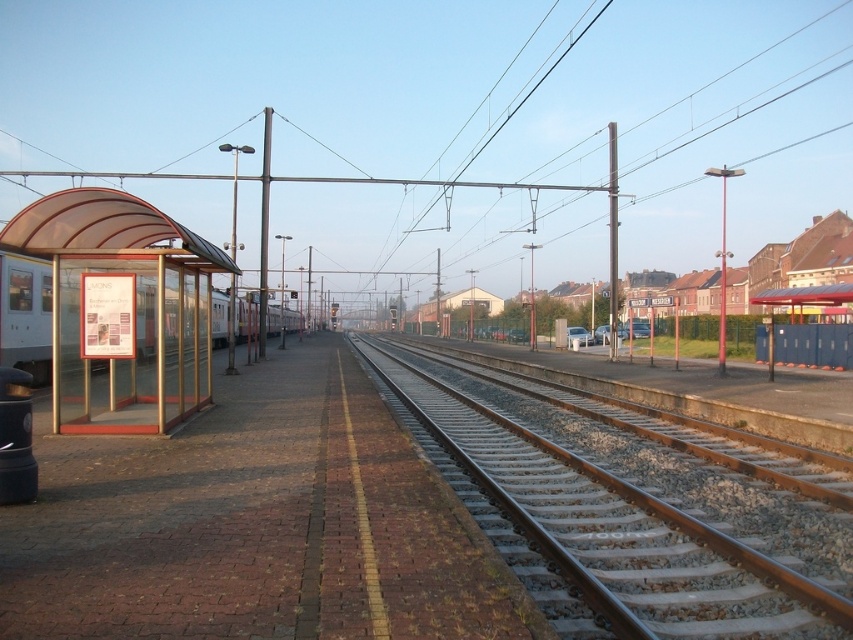
Question: From the image, what is the correct spatial relationship of metal/rustic track at center in relation to silver metallic train at left?

Choices:
 (A) right
 (B) left

Answer: (A)

Question: Estimate the real-world distances between objects in this image. Which object is closer to the transparent plastic bus stop at left?

Choices:
 (A) silver metallic train at left
 (B) metal/rustic track at center

Answer: (B)

Question: Does metal/rustic track at center appear over silver metallic train at left?

Choices:
 (A) yes
 (B) no

Answer: (B)

Question: Is metal/rustic track at center closer to the viewer compared to transparent plastic bus stop at left?

Choices:
 (A) yes
 (B) no

Answer: (A)

Question: Which point is farther to the camera?

Choices:
 (A) silver metallic train at left
 (B) metal/rustic track at center

Answer: (A)

Question: Which object is the farthest from the silver metallic train at left?

Choices:
 (A) transparent plastic bus stop at left
 (B) metal/rustic track at center

Answer: (B)